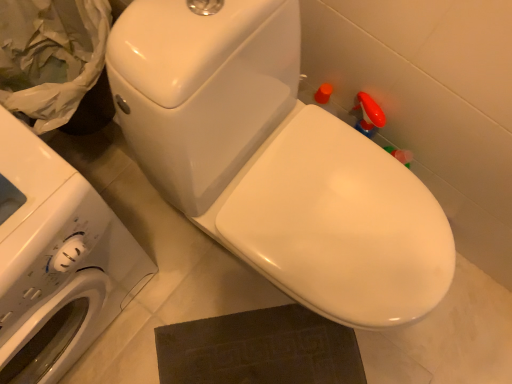
Question: Considering the relative sizes of white glossy washing machine at left and white glossy toilet at center in the image provided, is white glossy washing machine at left thinner than white glossy toilet at center?

Choices:
 (A) no
 (B) yes

Answer: (B)

Question: Would you say white glossy washing machine at left is outside white glossy toilet at center?

Choices:
 (A) yes
 (B) no

Answer: (A)

Question: Considering the relative sizes of white glossy washing machine at left and white glossy toilet at center in the image provided, is white glossy washing machine at left shorter than white glossy toilet at center?

Choices:
 (A) no
 (B) yes

Answer: (A)

Question: Is white glossy washing machine at left positioned far away from white glossy toilet at center?

Choices:
 (A) yes
 (B) no

Answer: (B)

Question: Is white glossy washing machine at left surrounding white glossy toilet at center?

Choices:
 (A) no
 (B) yes

Answer: (A)

Question: From the image's perspective, is white glossy washing machine at left under white glossy toilet at center?

Choices:
 (A) yes
 (B) no

Answer: (A)

Question: Considering the relative sizes of white glossy toilet at center and white glossy washing machine at left in the image provided, is white glossy toilet at center wider than white glossy washing machine at left?

Choices:
 (A) yes
 (B) no

Answer: (A)

Question: Does white glossy toilet at center have a smaller size compared to white glossy washing machine at left?

Choices:
 (A) no
 (B) yes

Answer: (B)

Question: From the image's perspective, is white glossy toilet at center under white glossy washing machine at left?

Choices:
 (A) no
 (B) yes

Answer: (A)

Question: Are white glossy toilet at center and white glossy washing machine at left far apart?

Choices:
 (A) no
 (B) yes

Answer: (A)

Question: Does white glossy toilet at center have a lesser width compared to white glossy washing machine at left?

Choices:
 (A) yes
 (B) no

Answer: (B)

Question: Is white glossy toilet at center touching white glossy washing machine at left?

Choices:
 (A) no
 (B) yes

Answer: (A)

Question: In terms of width, does white glossy washing machine at left look wider or thinner when compared to white glossy toilet at center?

Choices:
 (A) wide
 (B) thin

Answer: (B)